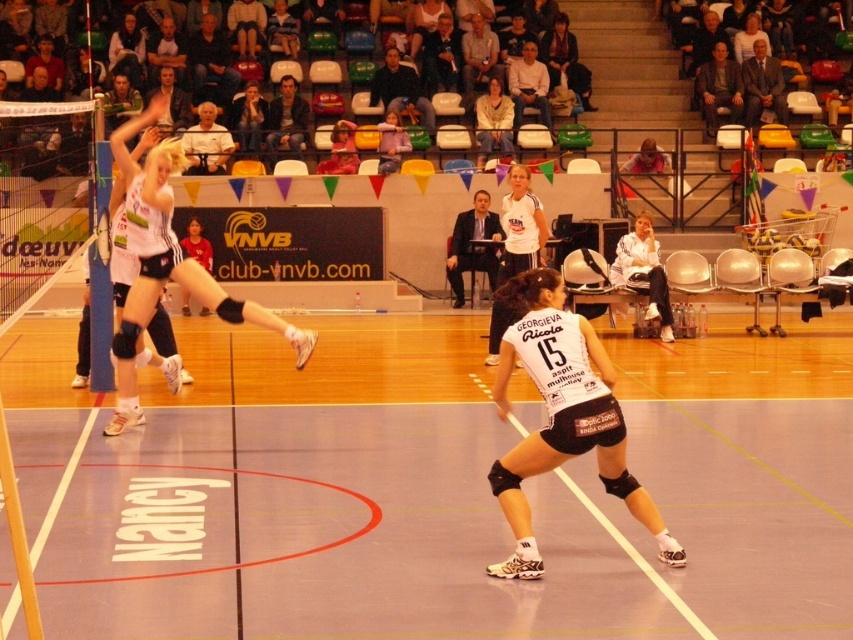
Is point (549, 42) positioned in front of point (346, 129)?

That is False.

Describe the element at coordinates (566, 60) in the screenshot. I see `dark brown leather jacket at upper center` at that location.

The height and width of the screenshot is (640, 853). What do you see at coordinates (566, 60) in the screenshot?
I see `dark brown leather jacket at upper center` at bounding box center [566, 60].

In order to click on dark brown leather jacket at upper center in this screenshot , I will do `click(566, 60)`.

Is light brown hair at upper center positioned in front of blonde hair at center?

No, light brown hair at upper center is behind blonde hair at center.

Who is more forward, [239,122] or [338,163]?

Point [338,163] is more forward.

At what (x,y) coordinates should I click in order to perform the action: click on light brown hair at upper center. Please return your answer as a coordinate pair (x, y). The width and height of the screenshot is (853, 640). Looking at the image, I should click on (248, 118).

Is smooth wooden floor at center taller than dark brown leather jacket at upper center?

In fact, smooth wooden floor at center may be shorter than dark brown leather jacket at upper center.

Between smooth wooden floor at center and dark brown leather jacket at upper center, which one appears on the left side from the viewer's perspective?

smooth wooden floor at center

Find the location of a particular element. This screenshot has width=853, height=640. smooth wooden floor at center is located at coordinates (364, 496).